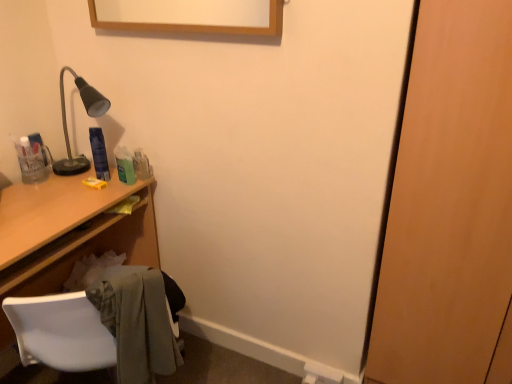
Question: Considering their positions, is blue plastic can at upper left located in front of or behind wooden desk at left?

Choices:
 (A) behind
 (B) front

Answer: (A)

Question: Is blue plastic can at upper left to the left or to the right of wooden desk at left in the image?

Choices:
 (A) right
 (B) left

Answer: (A)

Question: Which is nearer to the white plastic chair at lower left?

Choices:
 (A) wooden door at right
 (B) wooden desk at left
 (C) blue plastic can at upper left
 (D) light gray fabric at lower left

Answer: (D)

Question: Considering the real-world distances, which object is closest to the white plastic chair at lower left?

Choices:
 (A) wooden door at right
 (B) blue plastic can at upper left
 (C) wooden desk at left
 (D) light gray fabric at lower left

Answer: (D)